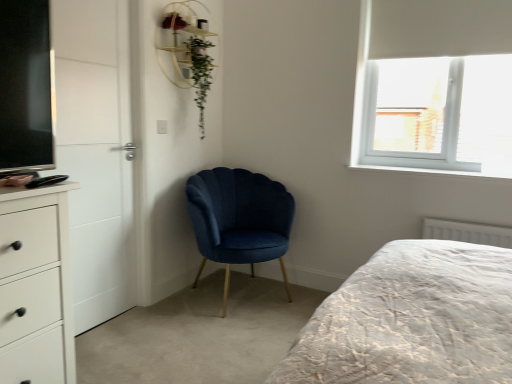
Identify the location of free spot below white plastic window at upper right (from a real-world perspective). coord(440,164).